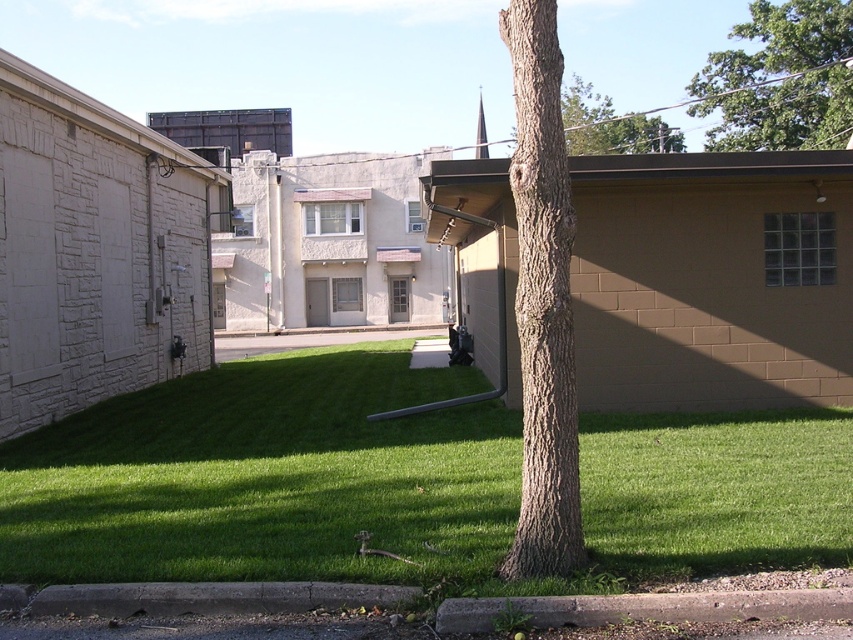
Question: Which point is closer to the camera taking this photo?

Choices:
 (A) (544, 243)
 (B) (831, 33)

Answer: (A)

Question: From the image, what is the correct spatial relationship of green grass at center in relation to brown rough bark tree trunk at center?

Choices:
 (A) left
 (B) right

Answer: (A)

Question: Which of the following is the closest to the observer?

Choices:
 (A) (560, 298)
 (B) (598, 97)
 (C) (834, 529)

Answer: (A)

Question: Can you confirm if green grass at center is thinner than brown rough bark tree trunk at center?

Choices:
 (A) yes
 (B) no

Answer: (B)

Question: Is green grass at center to the left of green leafy tree at upper right from the viewer's perspective?

Choices:
 (A) no
 (B) yes

Answer: (B)

Question: Which object is the farthest from the green grass at center?

Choices:
 (A) brown rough bark tree trunk at center
 (B) brown rough bark tree at upper center

Answer: (B)